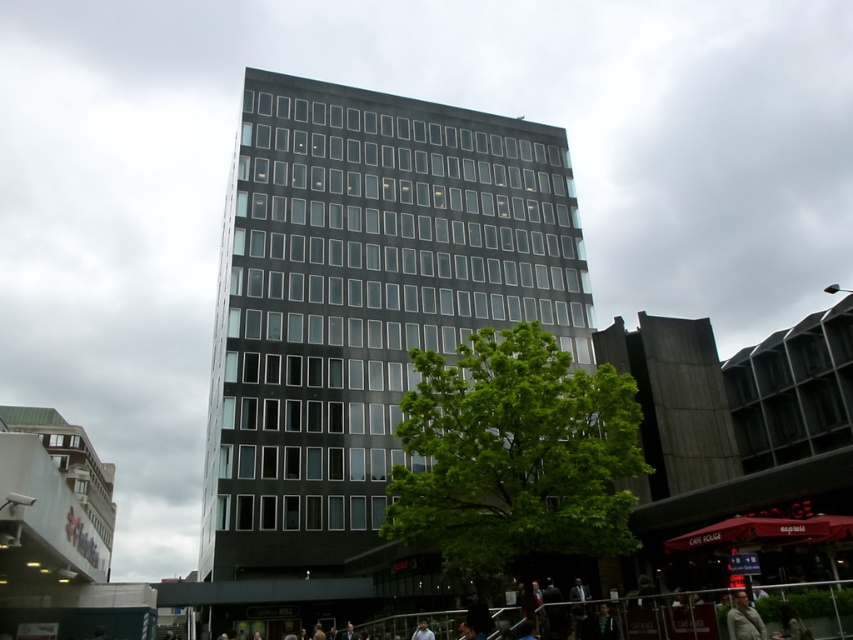
Question: Is black glass building at center above green fabric jacket at lower right?

Choices:
 (A) yes
 (B) no

Answer: (A)

Question: Which object is closer to the camera taking this photo?

Choices:
 (A) green fabric jacket at lower right
 (B) black glass building at center

Answer: (A)

Question: From the image, what is the correct spatial relationship of black glass building at center in relation to green fabric jacket at lower right?

Choices:
 (A) below
 (B) above

Answer: (B)

Question: Does black glass building at center have a smaller size compared to green fabric jacket at lower right?

Choices:
 (A) yes
 (B) no

Answer: (B)